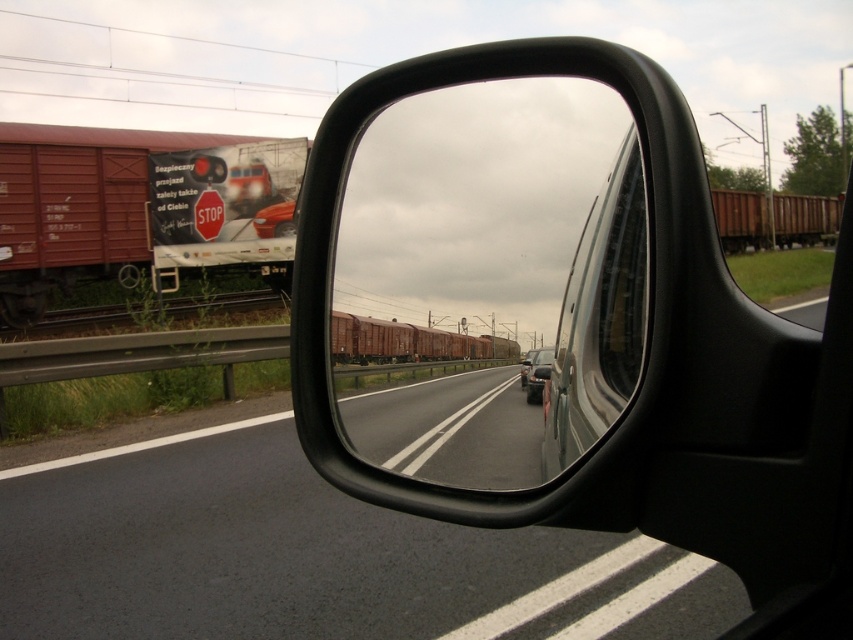
You are driving and notice a red matte freight car at left in your side mirror. Based on its position at point coordinates, can you estimate whether it is closer to the front or the back of your vehicle?

The red matte freight car at left is located at point coordinates (138, 209). Since the coordinates are closer to the bottom of the mirror, it suggests the freight car is closer to the back of your vehicle.

You are driving a car and looking at the side mirror. You see the red matte freight car at left and the shiny silver car at center. Which one is closer to the left edge of the mirror?

The red matte freight car at left is closer to the left edge of the mirror as it is positioned on the left side of the shiny silver car at center.

You are a passenger in the vehicle looking at the side mirror. You notice the red matte freight car at left and the transparent glass car window at center in the mirror. Which object appears taller in the reflection?

The red matte freight car at left appears taller than the transparent glass car window at center in the reflection because it has a greater height compared to the transparent glass car window at center.